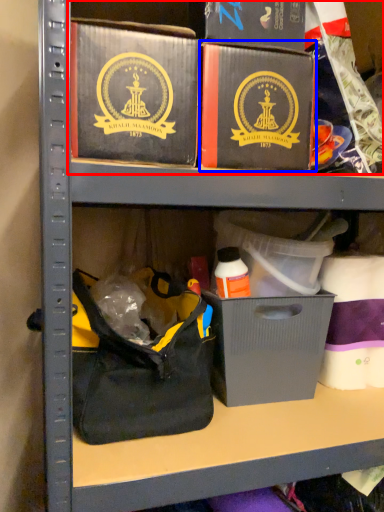
Question: Which object is closer to the camera taking this photo, collection (highlighted by a red box) or box (highlighted by a blue box)?

Choices:
 (A) collection
 (B) box

Answer: (B)